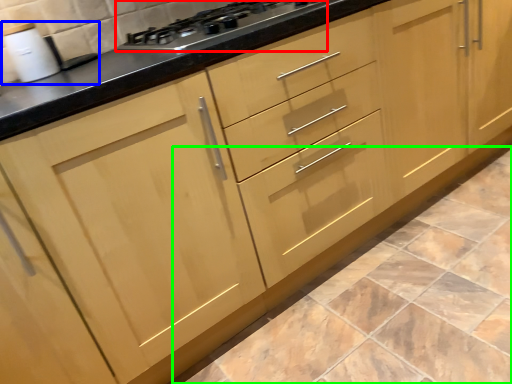
Question: Based on their relative distances, which object is nearer to gas stove (highlighted by a red box)? Choose from sink (highlighted by a blue box) and ceramic tile (highlighted by a green box).

Choices:
 (A) sink
 (B) ceramic tile

Answer: (A)